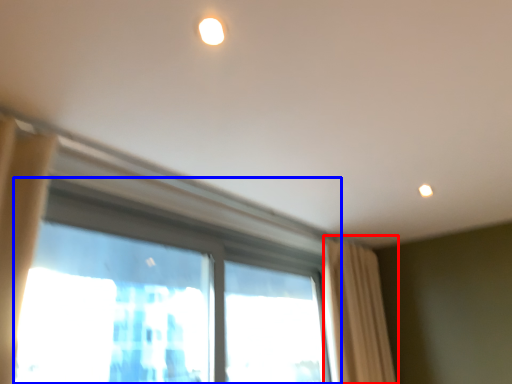
Question: Which object is closer to the camera taking this photo, curtain (highlighted by a red box) or window (highlighted by a blue box)?

Choices:
 (A) curtain
 (B) window

Answer: (B)